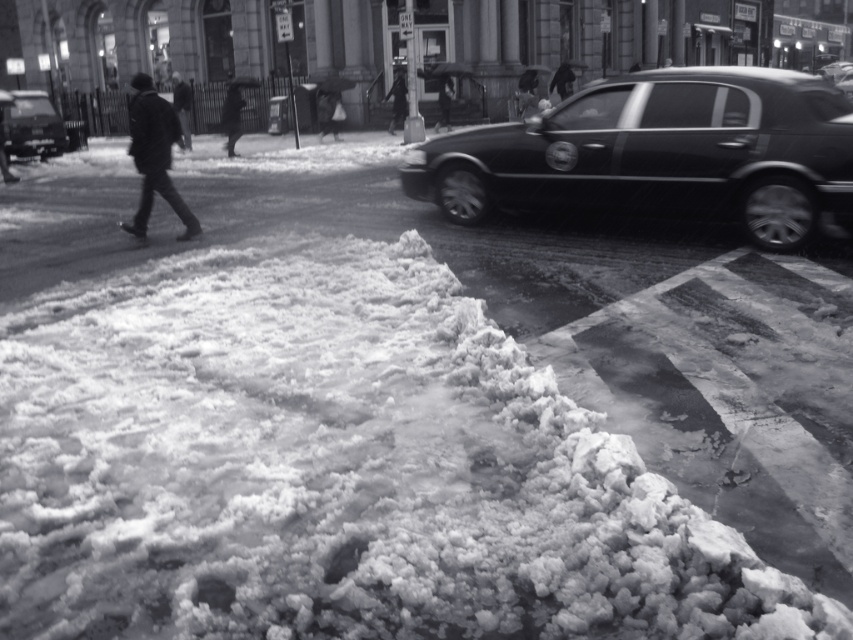
Question: Is dark wool coat at left closer to camera compared to shiny black car at left?

Choices:
 (A) yes
 (B) no

Answer: (A)

Question: Does dark wool coat at left have a lesser width compared to shiny black car at left?

Choices:
 (A) no
 (B) yes

Answer: (B)

Question: Which object is the farthest from the shiny black car at left?

Choices:
 (A) shiny black sedan at right
 (B) dark wool coat at left

Answer: (A)

Question: Can you confirm if shiny black sedan at right is positioned to the right of dark wool coat at left?

Choices:
 (A) yes
 (B) no

Answer: (A)

Question: Which of the following is the closest to the observer?

Choices:
 (A) (671, 209)
 (B) (4, 108)
 (C) (177, 208)

Answer: (A)

Question: Which of the following is the closest to the observer?

Choices:
 (A) shiny black sedan at right
 (B) dark wool coat at left
 (C) shiny black car at left

Answer: (A)